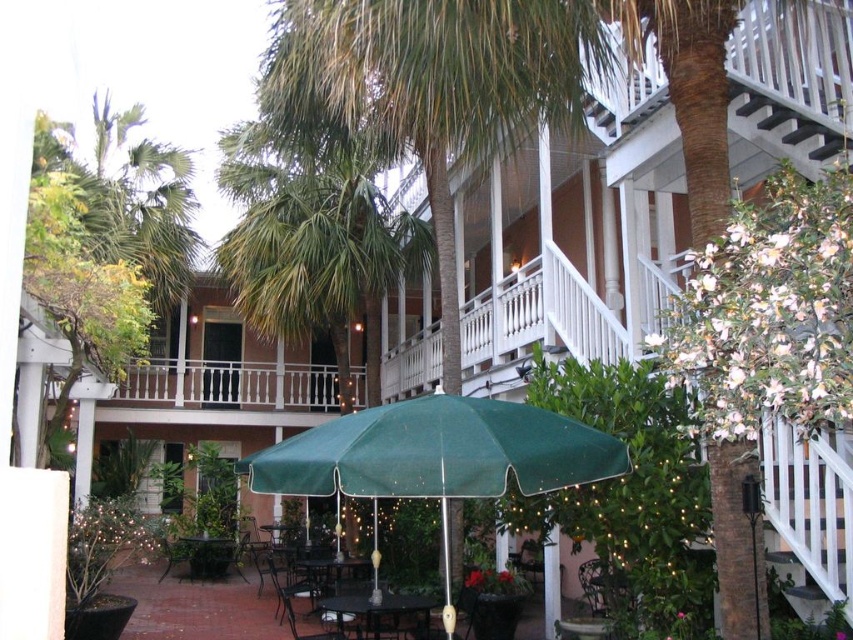
Is point (392, 602) less distant than point (282, 595)?

Yes, point (392, 602) is closer to viewer.

Can you confirm if black glass table at center is bigger than metallic silver chair at lower center?

Incorrect, black glass table at center is not larger than metallic silver chair at lower center.

The image size is (853, 640). I want to click on black glass table at center, so click(x=381, y=612).

Between metallic dark brown table at center and metallic black chair at lower center, which one is positioned lower?

metallic black chair at lower center is below.

Can you confirm if metallic dark brown table at center is wider than metallic black chair at lower center?

Yes, metallic dark brown table at center is wider than metallic black chair at lower center.

Measure the distance between metallic dark brown table at center and camera.

12.84 meters

Image resolution: width=853 pixels, height=640 pixels. Identify the location of metallic dark brown table at center. (207, 556).

I want to click on green fabric umbrella at center, so click(x=436, y=458).

Is green fabric umbrella at center to the left of metallic green chair at lower center from the viewer's perspective?

No, green fabric umbrella at center is not to the left of metallic green chair at lower center.

Who is more distant from viewer, (486, 417) or (280, 618)?

The point (280, 618) is more distant.

Where is `green fabric umbrella at center`? This screenshot has width=853, height=640. green fabric umbrella at center is located at coordinates (436, 458).